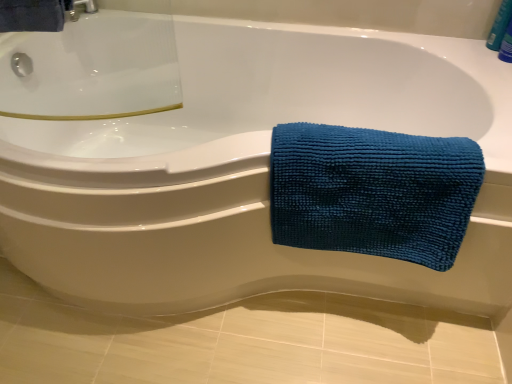
Question: Is blue plastic bottle at upper right bigger or smaller than teal microfiber towel at right?

Choices:
 (A) small
 (B) big

Answer: (A)

Question: In terms of height, does blue plastic bottle at upper right look taller or shorter compared to teal microfiber towel at right?

Choices:
 (A) short
 (B) tall

Answer: (A)

Question: In the image, is blue plastic bottle at upper right positioned in front of or behind teal microfiber towel at right?

Choices:
 (A) front
 (B) behind

Answer: (B)

Question: Considering the positions of teal microfiber towel at right and blue plastic bottle at upper right in the image, is teal microfiber towel at right wider or thinner than blue plastic bottle at upper right?

Choices:
 (A) thin
 (B) wide

Answer: (B)

Question: Considering their positions, is teal microfiber towel at right located in front of or behind blue plastic bottle at upper right?

Choices:
 (A) behind
 (B) front

Answer: (B)

Question: Do you think teal microfiber towel at right is within blue plastic bottle at upper right, or outside of it?

Choices:
 (A) outside
 (B) inside

Answer: (A)

Question: Is teal microfiber towel at right to the left or to the right of blue plastic bottle at upper right in the image?

Choices:
 (A) left
 (B) right

Answer: (A)